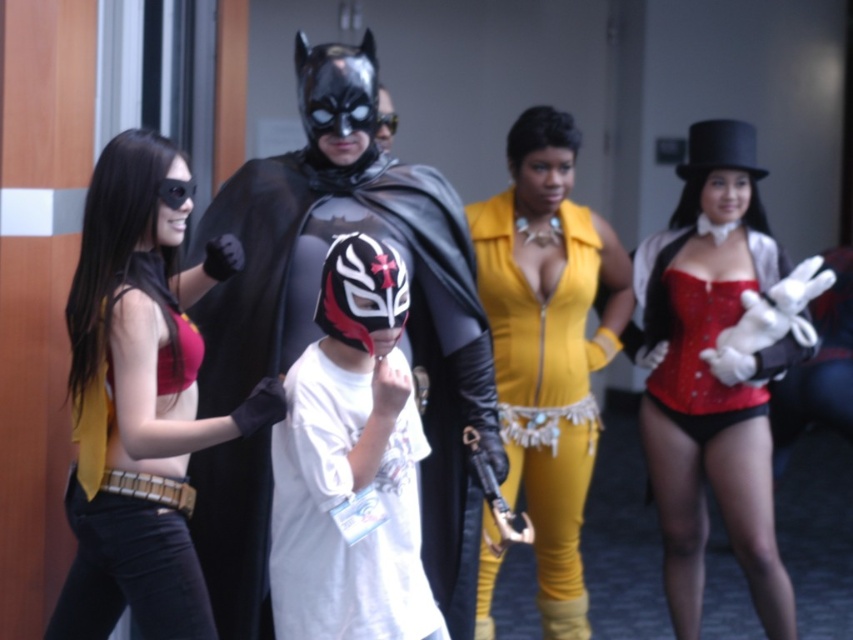
Between red satin corset at right and white matte mask at center, which one is positioned lower?

white matte mask at center is lower down.

Is red satin corset at right to the right of white matte mask at center from the viewer's perspective?

Correct, you'll find red satin corset at right to the right of white matte mask at center.

Between point (759, 602) and point (291, 572), which one is positioned in front?

Positioned in front is point (291, 572).

Where is `red satin corset at right`? Image resolution: width=853 pixels, height=640 pixels. red satin corset at right is located at coordinates (712, 374).

Can you confirm if shiny black costume at center is taller than matte red top at left?

Yes, shiny black costume at center is taller than matte red top at left.

Is point (352, 64) positioned after point (187, 381)?

That is True.

Identify the location of shiny black costume at center. (318, 285).

The image size is (853, 640). In order to click on shiny black costume at center in this screenshot , I will do `click(318, 285)`.

Is red satin corset at right in front of yellow leather jumpsuit at center?

No, it is behind yellow leather jumpsuit at center.

Can you confirm if red satin corset at right is positioned to the right of yellow leather jumpsuit at center?

Indeed, red satin corset at right is positioned on the right side of yellow leather jumpsuit at center.

The height and width of the screenshot is (640, 853). I want to click on red satin corset at right, so click(x=712, y=374).